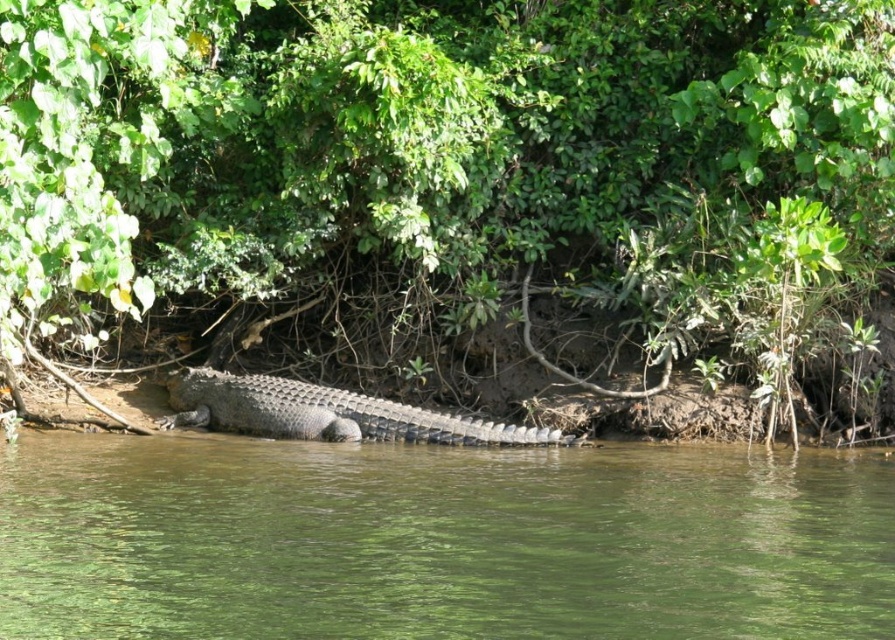
Question: Can you confirm if greenish-brown water at center is wider than sandy brown scaly crocodile at center?

Choices:
 (A) yes
 (B) no

Answer: (A)

Question: Which of the following is the farthest from the observer?

Choices:
 (A) green leafy tree at center
 (B) greenish-brown water at center
 (C) sandy brown scaly crocodile at center

Answer: (C)

Question: Which of the following is the farthest from the observer?

Choices:
 (A) sandy brown scaly crocodile at center
 (B) green leafy tree at center
 (C) greenish-brown water at center

Answer: (A)

Question: Where is green leafy tree at center located in relation to greenish-brown water at center in the image?

Choices:
 (A) below
 (B) above

Answer: (B)

Question: Can you confirm if green leafy tree at center is positioned to the right of greenish-brown water at center?

Choices:
 (A) no
 (B) yes

Answer: (B)

Question: Which of these objects is positioned farthest from the greenish-brown water at center?

Choices:
 (A) sandy brown scaly crocodile at center
 (B) green leafy tree at center

Answer: (B)